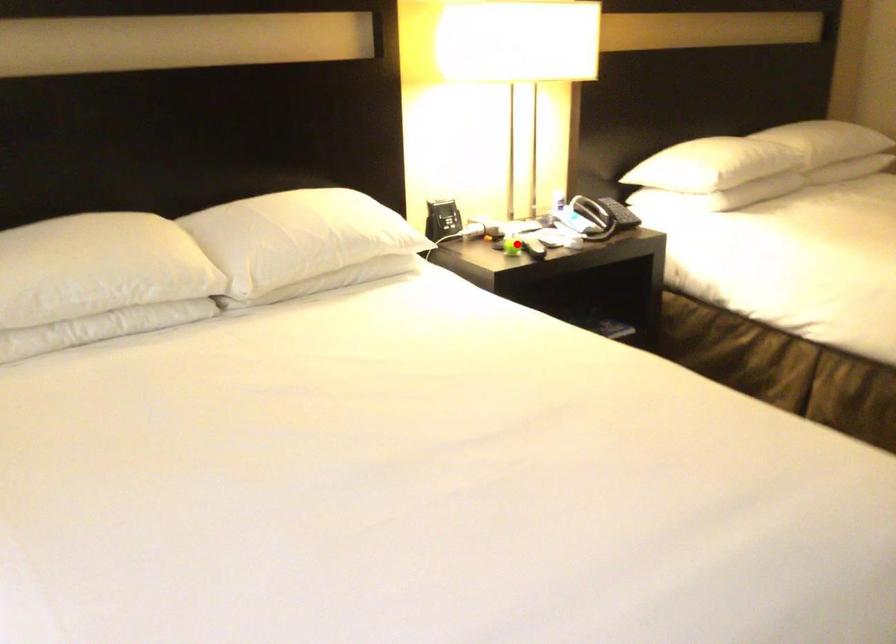
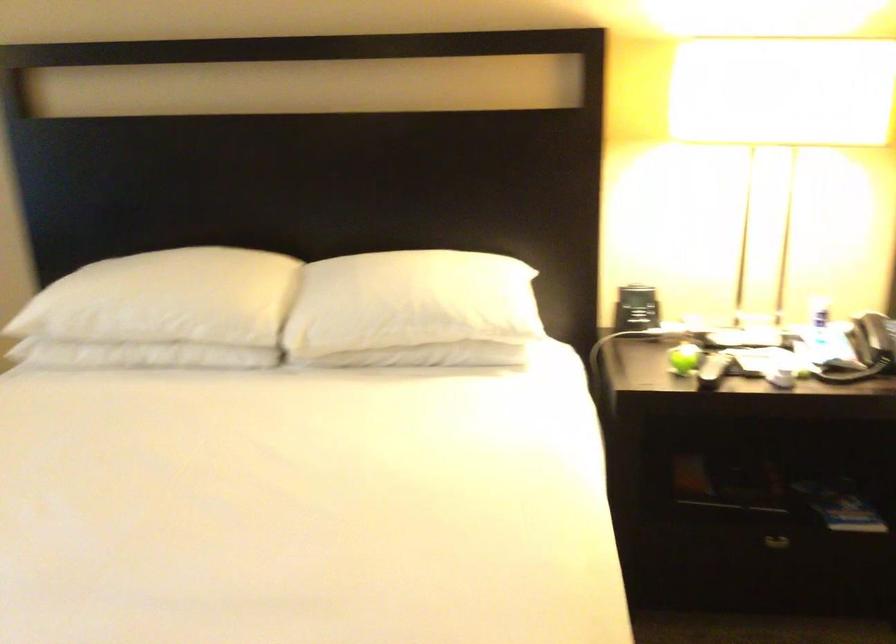
Where in the second image is the point corresponding to the highlighted location from the first image?

(684, 359)